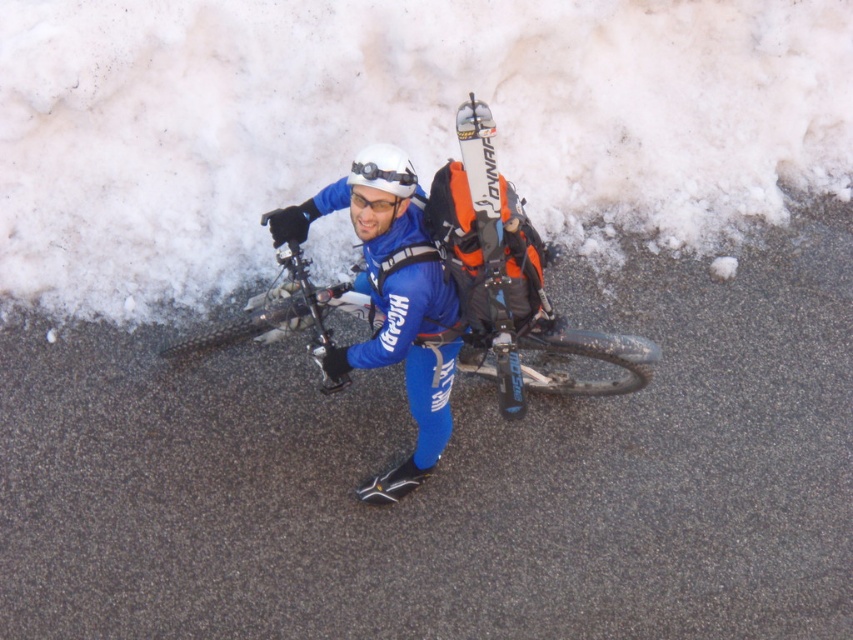
You are planning to carry both the white matte ski at center and the white matte helmet at center in a backpack with a width limit of 30 cm. Given their widths, which item would you prioritize packing first to ensure it fits?

The white matte ski at center has a lesser width compared to the white matte helmet at center. Therefore, you should prioritize packing the white matte helmet at center first since it is wider and needs more space. After that, the narrower white matte ski at center can be placed in the remaining space.

You are a winter sports instructor preparing for a lesson. You notice the white matte ski at center and the white matte goggles at center. Which object is taller when viewed from the front?

The white matte ski at center is taller than the white matte goggles at center.

You are planning to carry both the matte black mountain bike at center and the clear plastic goggles at center in your car trunk. Which item should you place first to maximize space efficiency?

Since the matte black mountain bike at center is larger in size than the clear plastic goggles at center, you should place the matte black mountain bike at center first in the car trunk to maximize space efficiency by putting larger items first.